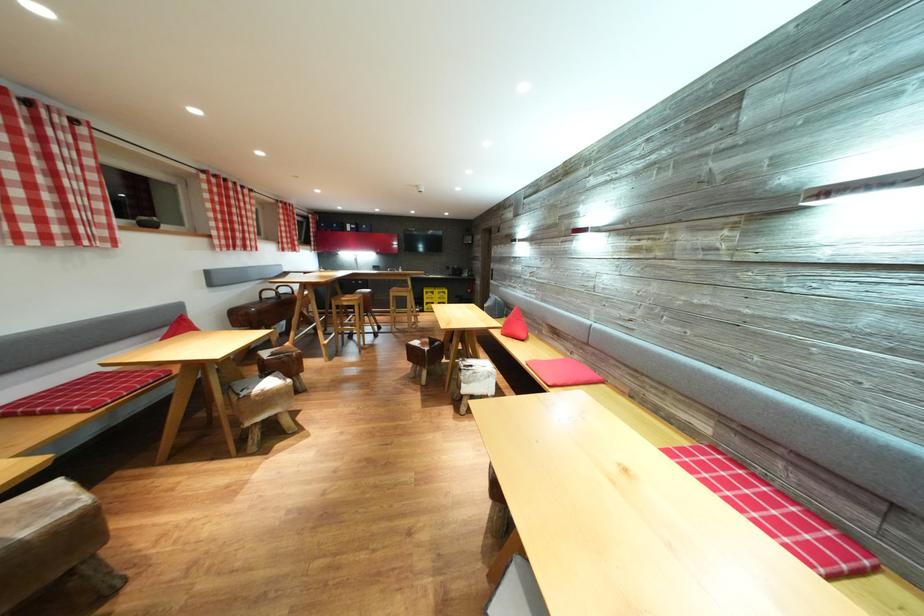
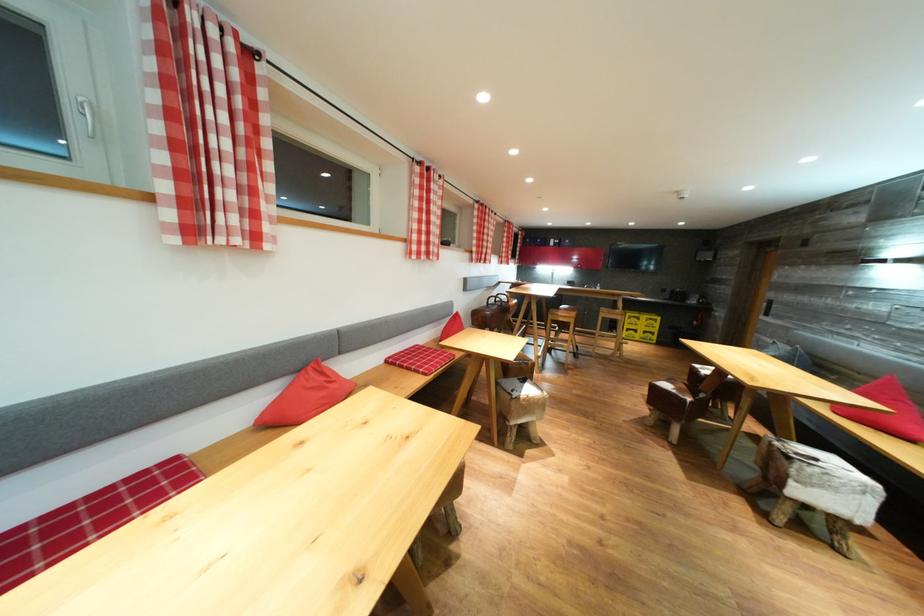
Where in the second image is the point corresponding to (x=433, y=345) from the first image?

(689, 392)